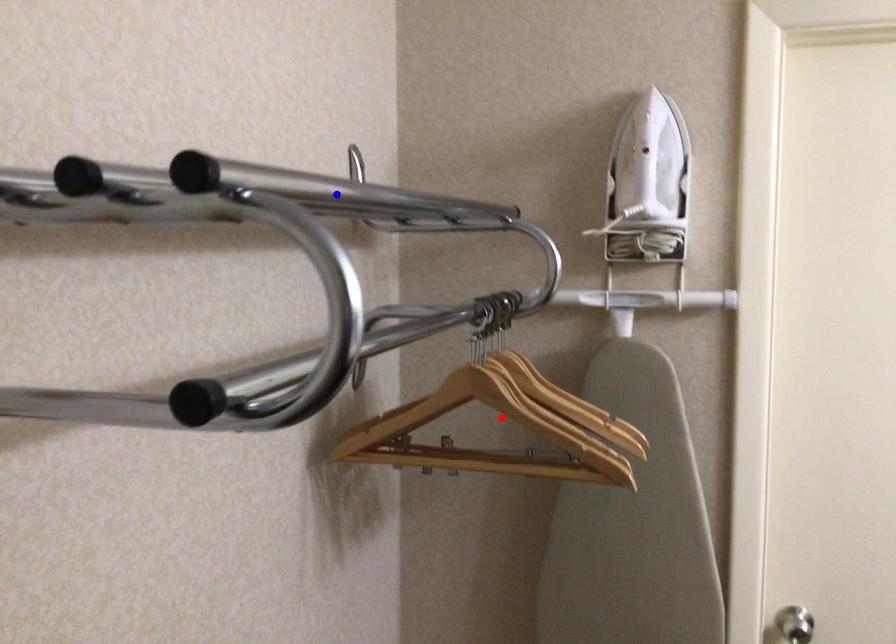
Question: Which of the two points in the image is closer to the camera?

Choices:
 (A) Blue point is closer.
 (B) Red point is closer.

Answer: (B)